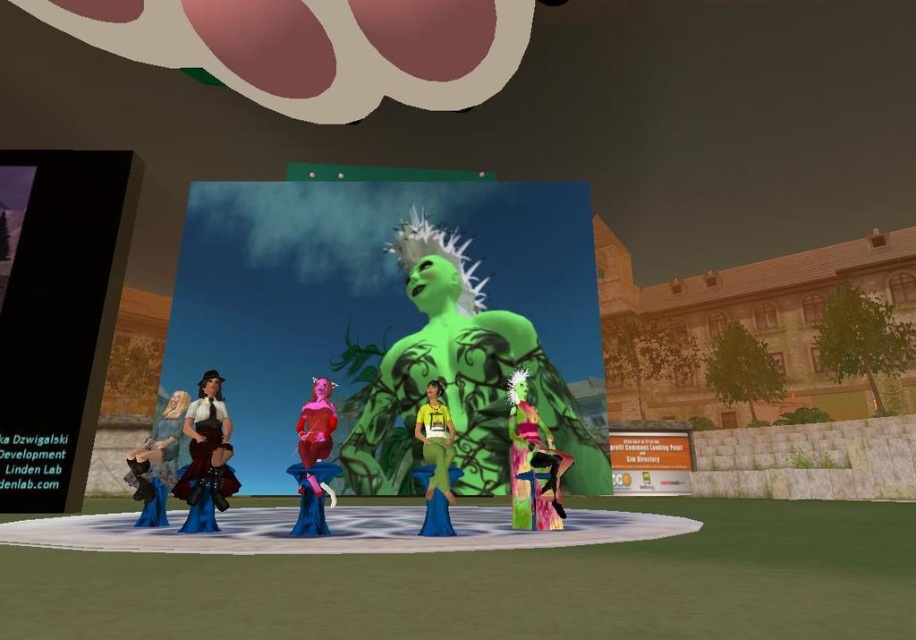
You are an avatar attending a themed event and notice two outfits in the scene. The first is a matte brown leather vest at left, and the second is a yellow matte dress at center. Which of these outfits is positioned further to the left?

The matte brown leather vest at left is positioned further to the left compared to the yellow matte dress at center, as it is located to the left of the dress.

In the scene shown: You are an avatar in this virtual environment and want to take a photo of the multicolored fabric dress at center without the green matte statue at center blocking the view. Is there a position you can move to where the statue is not in front of the dress?

The multicolored fabric dress at center is behind the green matte statue at center, so moving around the statue might allow you to position yourself where the dress is visible without the statue blocking the view. However, since the dress is behind the statue, you would need to find a path around or behind the statue to capture the dress without obstruction.

You are an avatar in the scene and want to know which piece of clothing is bigger between the matte brown leather vest at left and the yellow matte dress at center. Can you determine this?

Answer: The matte brown leather vest at left has a larger size compared to the yellow matte dress at center, so the matte brown leather vest at left is bigger.